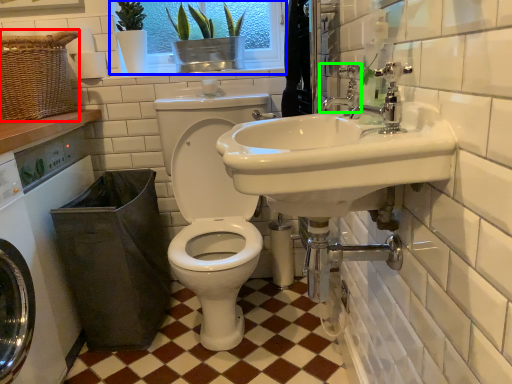
Question: Which object is positioned closest to basket (highlighted by a red box)? Select from window screen (highlighted by a blue box) and tap (highlighted by a green box).

Choices:
 (A) window screen
 (B) tap

Answer: (A)